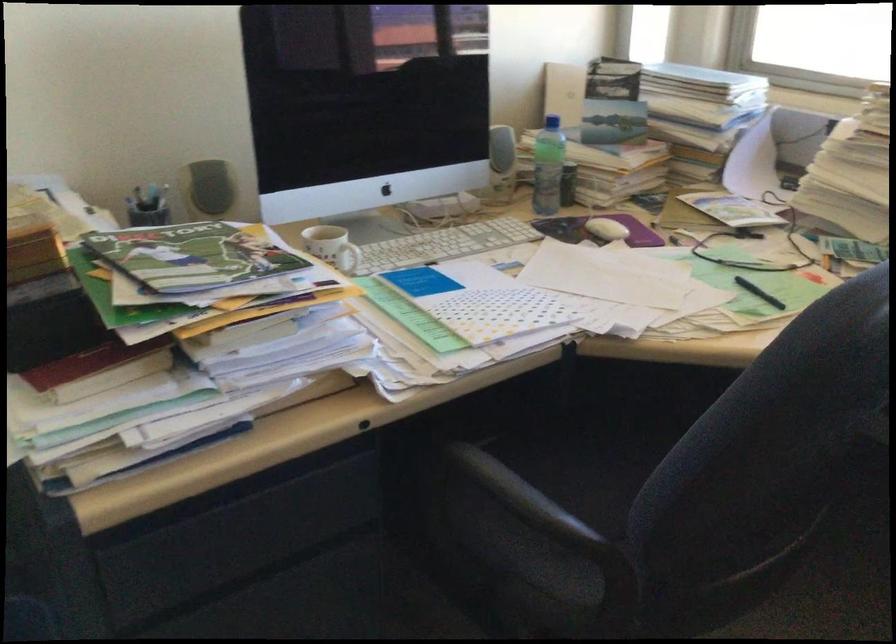
The location [759,292] corresponds to which object?

It corresponds to the black pen in the image.